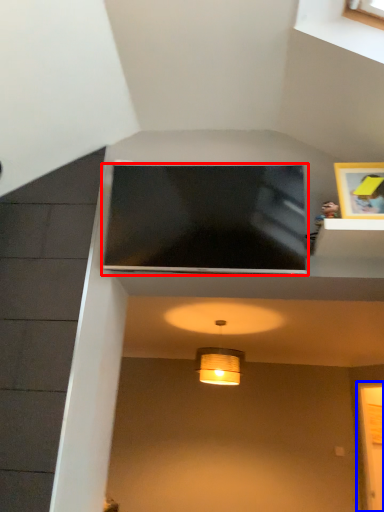
Question: Which object appears closest to the camera in this image, television (highlighted by a red box) or glass door (highlighted by a blue box)?

Choices:
 (A) television
 (B) glass door

Answer: (A)